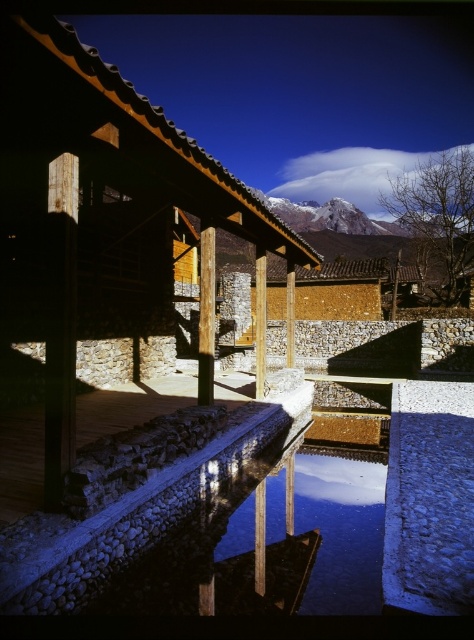
Question: Is wooden hut at center to the left of wooden post at center from the viewer's perspective?

Choices:
 (A) yes
 (B) no

Answer: (B)

Question: Which point appears closest to the camera in this image?

Choices:
 (A) (255, 376)
 (B) (9, 296)

Answer: (B)

Question: Which point is farther to the camera?

Choices:
 (A) (382, 474)
 (B) (211, 280)
 (C) (61, 33)
 (D) (75, 262)

Answer: (A)

Question: Does wooden hut at center have a larger size compared to wooden post at center?

Choices:
 (A) yes
 (B) no

Answer: (A)

Question: Which of the following is the farthest from the observer?

Choices:
 (A) matte wood pillar at center
 (B) smooth stone pillar at center
 (C) smooth wooden post at center
 (D) transparent glass water at center

Answer: (C)

Question: Is smooth stone pillar at center wider than smooth wooden post at center?

Choices:
 (A) yes
 (B) no

Answer: (B)